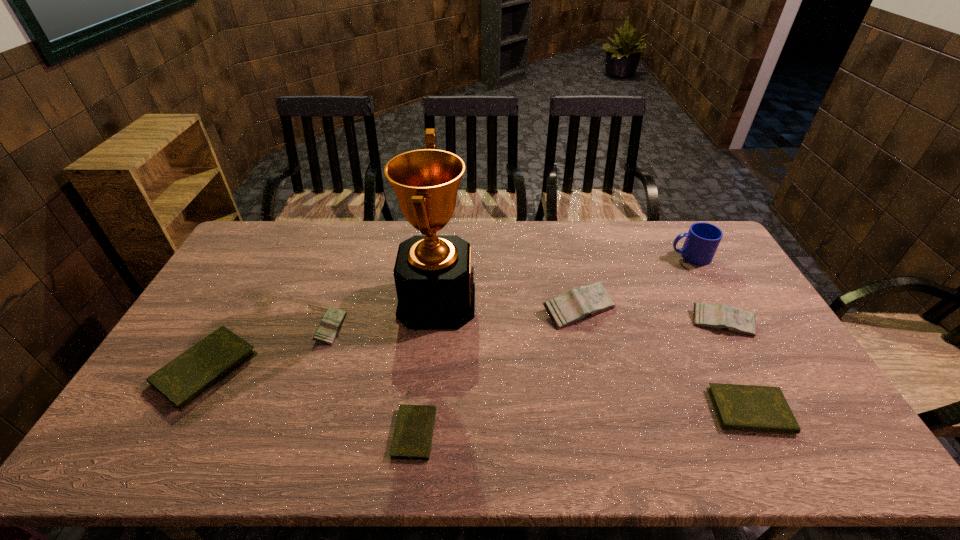
Where is `the sixth tallest object`? the sixth tallest object is located at coordinates (185, 379).

Identify the location of the biggest green diary. Image resolution: width=960 pixels, height=540 pixels. [185, 379].

Locate an element on the screen. The height and width of the screenshot is (540, 960). the second shortest object is located at coordinates (738, 407).

Where is `the second shortest diary`? This screenshot has height=540, width=960. the second shortest diary is located at coordinates (738, 407).

At what (x,y) coordinates should I click in order to perform the action: click on the second green diary from left to right. Please return your answer as a coordinate pair (x, y). Image resolution: width=960 pixels, height=540 pixels. Looking at the image, I should click on (412, 439).

This screenshot has height=540, width=960. In order to click on the fourth diary from right to left in this screenshot , I will do `click(412, 439)`.

At what (x,y) coordinates should I click in order to perform the action: click on vacant position located on the front of the gold trophy cup with the label. Please return your answer as a coordinate pair (x, y). This screenshot has width=960, height=540. Looking at the image, I should click on (571, 302).

Find the location of `vacant area situated 0.130m on the side with the handle of the mug`. vacant area situated 0.130m on the side with the handle of the mug is located at coordinates (634, 256).

Locate an element on the screen. vacant space situated on the side with the handle of the mug is located at coordinates (653, 256).

The height and width of the screenshot is (540, 960). Find the location of `vacant space located on the side with the handle of the mug`. vacant space located on the side with the handle of the mug is located at coordinates (647, 256).